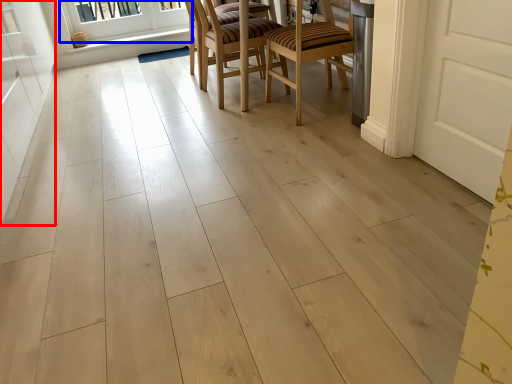
Question: Which object is further to the camera taking this photo, screen door (highlighted by a red box) or window (highlighted by a blue box)?

Choices:
 (A) screen door
 (B) window

Answer: (B)